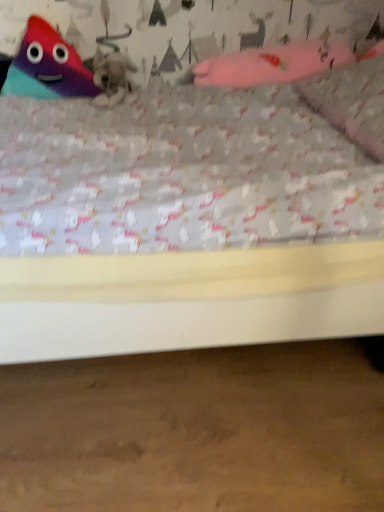
Question: From the image's perspective, is pink fabric pillow at upper right beneath matte plastic triangle at upper left, which appears as the 2th toy when viewed from the right?

Choices:
 (A) yes
 (B) no

Answer: (A)

Question: Is pink fabric pillow at upper right not within matte plastic triangle at upper left, the 1th toy viewed from the left?

Choices:
 (A) no
 (B) yes

Answer: (B)

Question: Considering the relative sizes of pink fabric pillow at upper right and matte plastic triangle at upper left, which appears as the 2th toy when viewed from the right, in the image provided, is pink fabric pillow at upper right bigger than matte plastic triangle at upper left, which appears as the 2th toy when viewed from the right,?

Choices:
 (A) no
 (B) yes

Answer: (B)

Question: Is pink fabric pillow at upper right thinner than matte plastic triangle at upper left, the 1th toy viewed from the left?

Choices:
 (A) no
 (B) yes

Answer: (A)

Question: From the image's perspective, is pink fabric pillow at upper right above matte plastic triangle at upper left, the 1th toy viewed from the left?

Choices:
 (A) yes
 (B) no

Answer: (B)

Question: Is pink fabric pillow at upper right closer to camera compared to matte plastic triangle at upper left, the 1th toy viewed from the left?

Choices:
 (A) no
 (B) yes

Answer: (B)

Question: From a real-world perspective, is fuzzy gray cat at upper center located beneath pink fabric glove at upper right, the second toy from the left?

Choices:
 (A) no
 (B) yes

Answer: (B)

Question: Does fuzzy gray cat at upper center have a lesser height compared to pink fabric glove at upper right, which ranks as the 1th toy in right-to-left order?

Choices:
 (A) no
 (B) yes

Answer: (B)

Question: Does fuzzy gray cat at upper center come behind pink fabric glove at upper right, the second toy from the left?

Choices:
 (A) no
 (B) yes

Answer: (B)

Question: Is fuzzy gray cat at upper center closer to camera compared to pink fabric glove at upper right, which ranks as the 1th toy in right-to-left order?

Choices:
 (A) no
 (B) yes

Answer: (A)

Question: Is fuzzy gray cat at upper center not inside pink fabric glove at upper right, the second toy from the left?

Choices:
 (A) yes
 (B) no

Answer: (A)

Question: Does fuzzy gray cat at upper center have a greater height compared to pink fabric glove at upper right, the second toy from the left?

Choices:
 (A) yes
 (B) no

Answer: (B)

Question: Is matte plastic triangle at upper left, the 1th toy viewed from the left, with fuzzy gray cat at upper center?

Choices:
 (A) no
 (B) yes

Answer: (A)